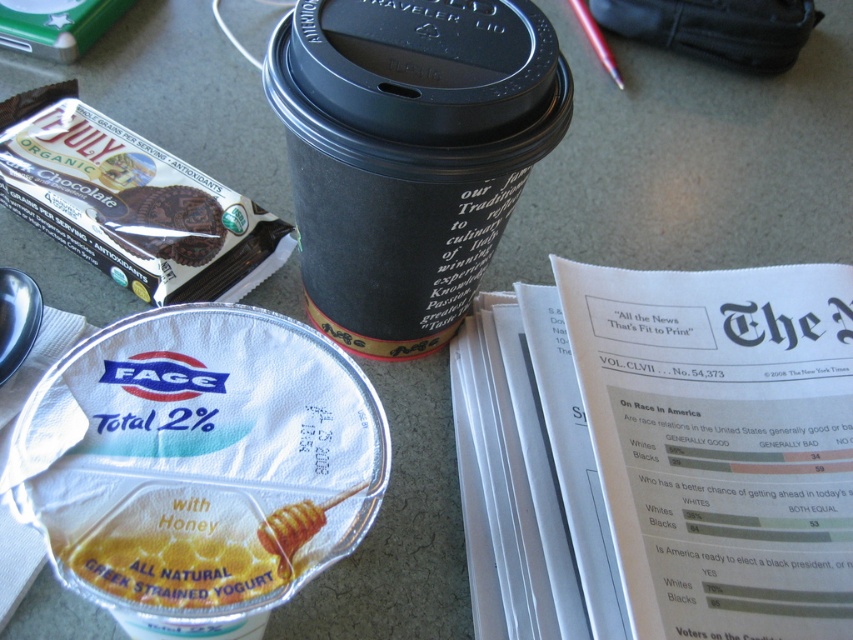
You are standing at the desk and want to reach the point marked at coordinates [169,248]. If your hand can extend 1 meter forward, will you be able to reach that point?

The distance of point [169,248] from the viewer is 1.04 meters, so your hand can only extend 1 meter forward, which is shorter than the required distance. Therefore, you cannot reach the point marked at coordinates [169,248].

You are organizing items on a desk and need to place a new item at point coordinates. Where should you place it so it doesn t overlap with the chocolate wafer at upper left?

Place the new item anywhere except the coordinates at point (166, 224) where the chocolate wafer at upper left is located.

You are a delivery person who needs to place a 12 inch long package between the black paper cup at upper center and the chocolate wafer at upper left. Can you fit it there?

The distance between the black paper cup at upper center and the chocolate wafer at upper left is 12.20 inches, so yes, the 12 inch long package can fit between them since it is slightly shorter than the available space.